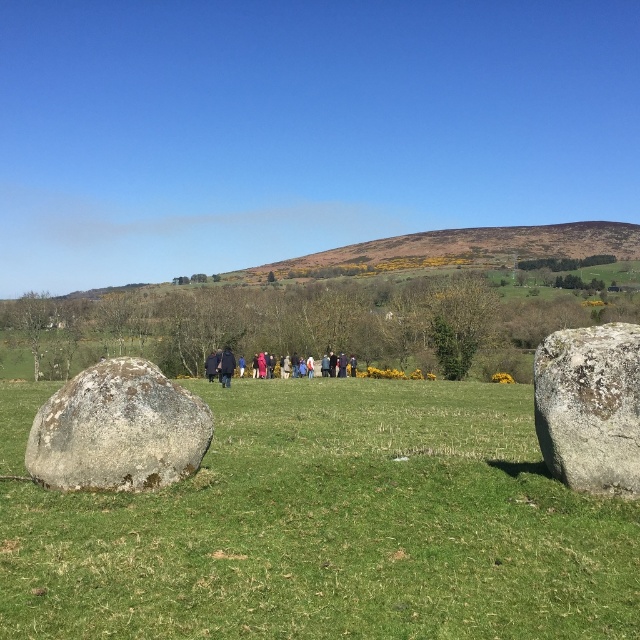
You are a photographer trying to capture a wide shot of the scene. You need to ensure that both the speckled gray rock at center and the dark blue coat at center are clearly visible. Given their sizes, which object might require you to adjust your camera angle to avoid being too small in the frame?

The speckled gray rock at center has a smaller width than the dark blue coat at center, so it might require adjusting the camera angle to ensure it is not too small in the frame.

You are a photographer standing at the edge of the field. You want to capture a photo where the speckled gray rock at center and the dark blue coat at center are both clearly visible. Considering their sizes, which object will appear taller in the photo?

The speckled gray rock at center will appear taller in the photo because it has a greater height compared to the dark blue coat at center.